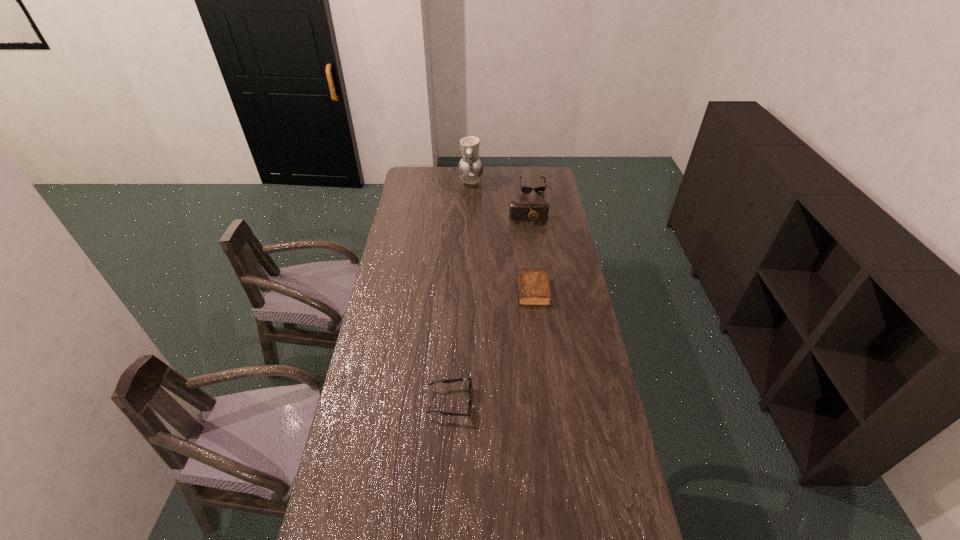
I want to click on free space at the left edge, so click(x=360, y=505).

This screenshot has width=960, height=540. Identify the location of free space at the right edge of the desktop. (629, 513).

In order to click on free space at the far right corner in this screenshot , I will do `click(552, 174)`.

Where is `unoccupied area between the diary and the nearest object`? unoccupied area between the diary and the nearest object is located at coordinates (492, 347).

At what (x,y) coordinates should I click in order to perform the action: click on vacant space in between the second tallest object and the left sunglasses. Please return your answer as a coordinate pair (x, y). The width and height of the screenshot is (960, 540). Looking at the image, I should click on (490, 311).

This screenshot has width=960, height=540. What are the coordinates of `vacant region between the right sunglasses and the tallest object` in the screenshot? It's located at (501, 185).

Locate an element on the screen. vacant area that lies between the pottery and the right sunglasses is located at coordinates (501, 185).

Identify the location of vacant area between the diary and the nearer sunglasses. (492, 347).

Image resolution: width=960 pixels, height=540 pixels. Find the location of `free space between the nearest object and the tallest object`. free space between the nearest object and the tallest object is located at coordinates (461, 293).

Where is `free space between the fourth farthest object and the fourth shortest object`? free space between the fourth farthest object and the fourth shortest object is located at coordinates (531, 255).